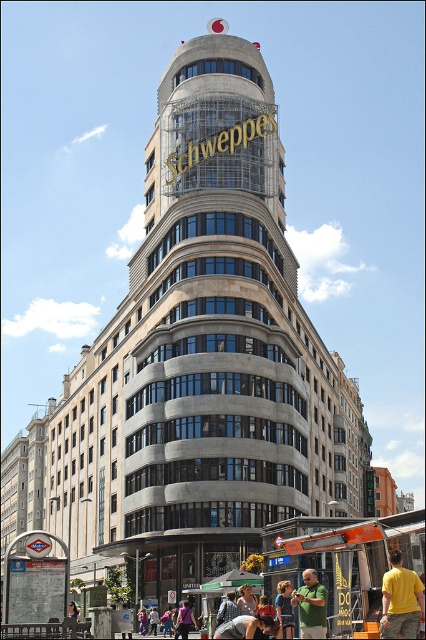
Question: Does purple fabric dress at center lie behind pink fabric bag at center?

Choices:
 (A) no
 (B) yes

Answer: (A)

Question: Which object is the closest to the denim jacket at center?

Choices:
 (A) yellow cotton shirt at lower right
 (B) light brown leather jacket at center

Answer: (B)

Question: Which of these objects is positioned closest to the orange fabric food truck at lower right?

Choices:
 (A) blue denim jeans at lower center
 (B) pink fabric bag at center
 (C) yellow cotton shirt at lower right

Answer: (A)

Question: Which of the following is the closest to the observer?

Choices:
 (A) (238, 595)
 (B) (408, 516)
 (C) (154, 605)

Answer: (B)

Question: Is orange fabric food truck at lower right closer to the viewer compared to blue denim jeans at lower center?

Choices:
 (A) yes
 (B) no

Answer: (A)

Question: Does gray concrete building at center have a lesser width compared to orange fabric food truck at lower right?

Choices:
 (A) no
 (B) yes

Answer: (A)